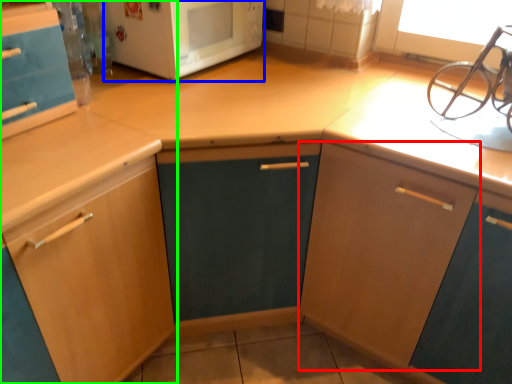
Question: Which is nearer to the cabinetry (highlighted by a red box)? microwave oven (highlighted by a blue box) or cabinetry (highlighted by a green box).

Choices:
 (A) microwave oven
 (B) cabinetry

Answer: (B)